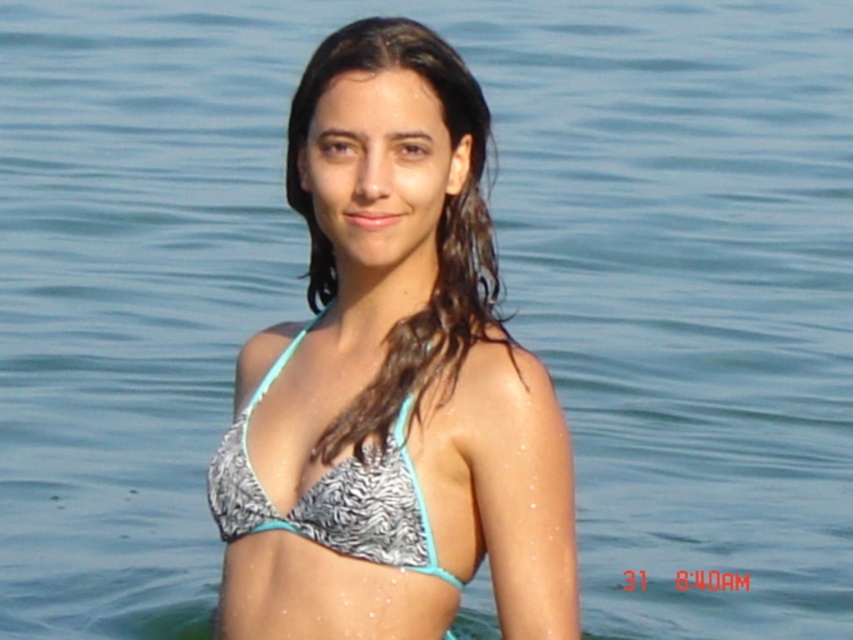
Question: Is white printed bikini top at center below printed fabric bikini top at center?

Choices:
 (A) no
 (B) yes

Answer: (A)

Question: Can you confirm if white printed bikini top at center is bigger than teal fabric bikini top at center?

Choices:
 (A) yes
 (B) no

Answer: (A)

Question: Which point is farther to the camera?

Choices:
 (A) (350, 355)
 (B) (271, 380)
 (C) (405, 387)

Answer: (A)

Question: Where is white printed bikini top at center located in relation to printed fabric bikini top at center in the image?

Choices:
 (A) right
 (B) left

Answer: (A)

Question: Which point is closer to the camera?

Choices:
 (A) (538, 531)
 (B) (236, 419)

Answer: (A)

Question: Which object appears farthest from the camera in this image?

Choices:
 (A) printed fabric bikini top at center
 (B) teal fabric bikini top at center

Answer: (B)